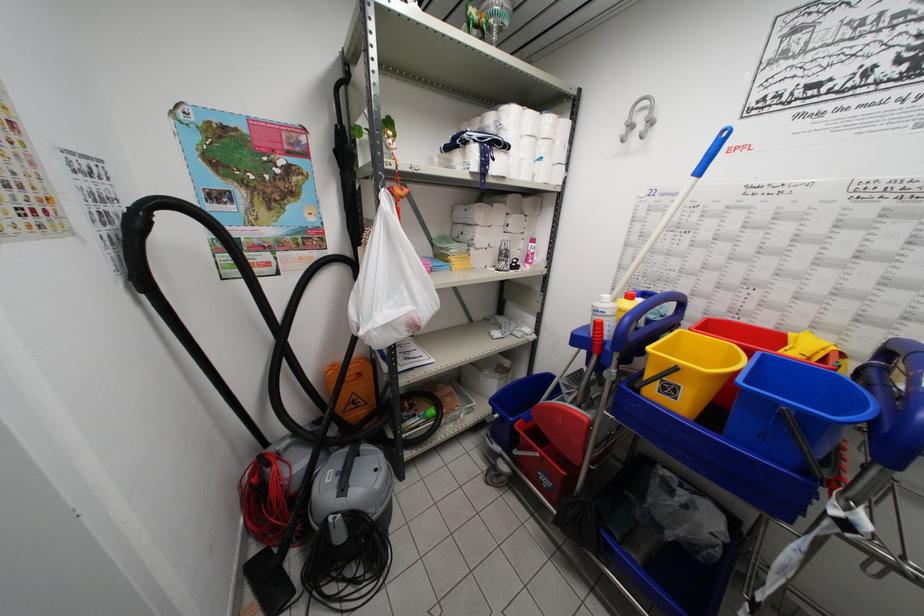
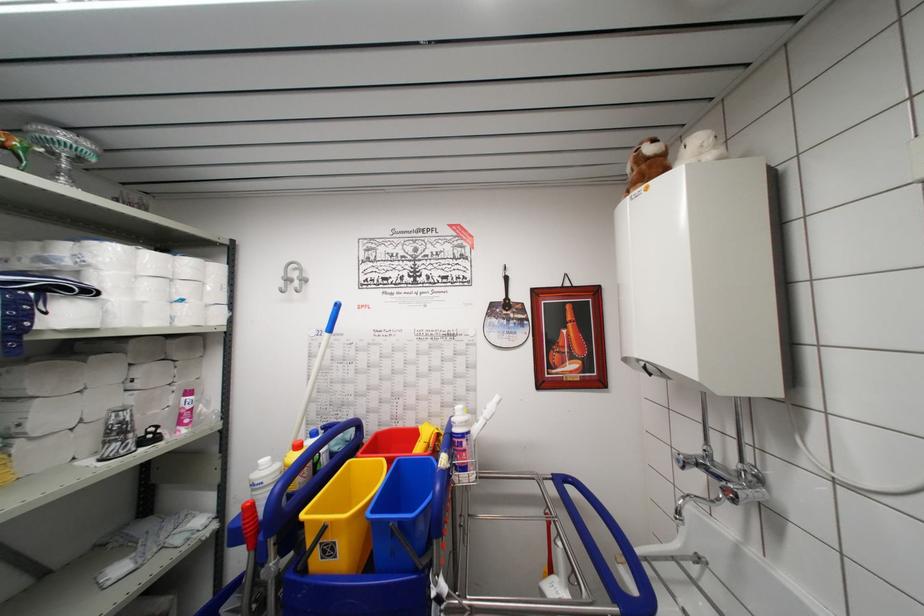
Find the pixel in the second image that matches point (767, 359) in the first image.

(402, 466)